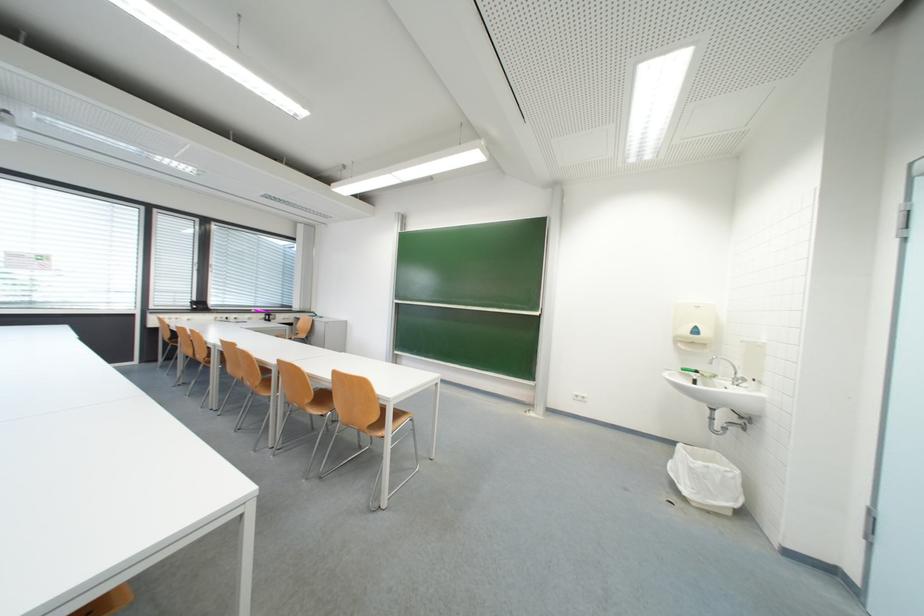
Locate an element on the screen. metal faucet handle is located at coordinates (726, 379).